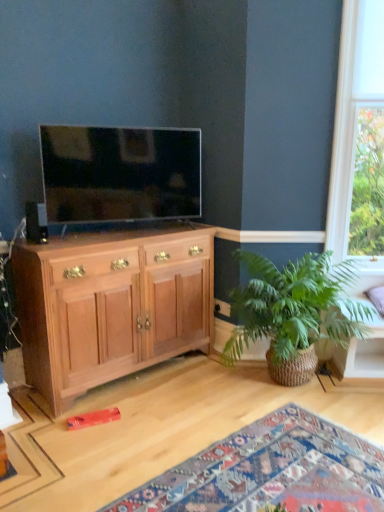
Where is `vacant space situated on the left part of green woven basket at right`? This screenshot has height=512, width=384. vacant space situated on the left part of green woven basket at right is located at coordinates (169, 410).